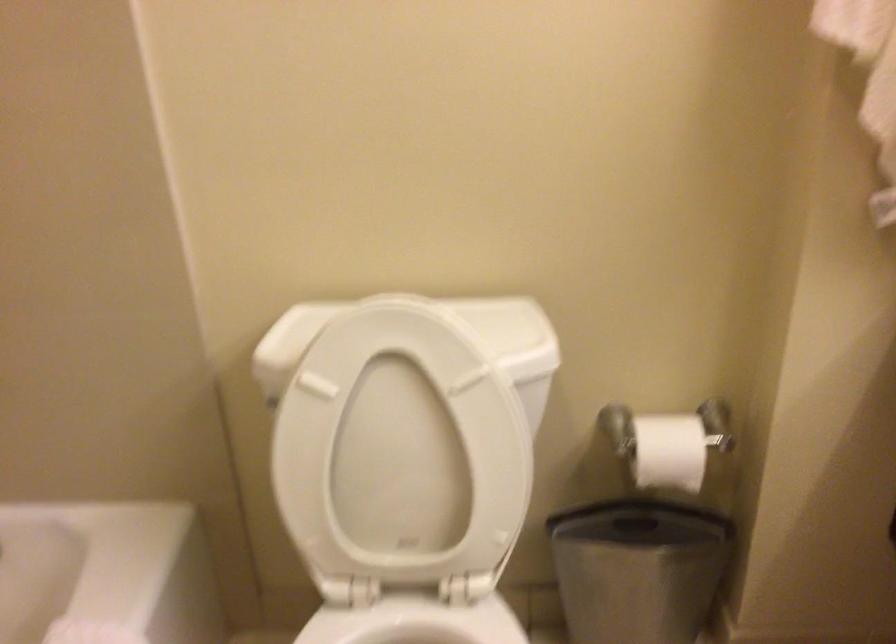
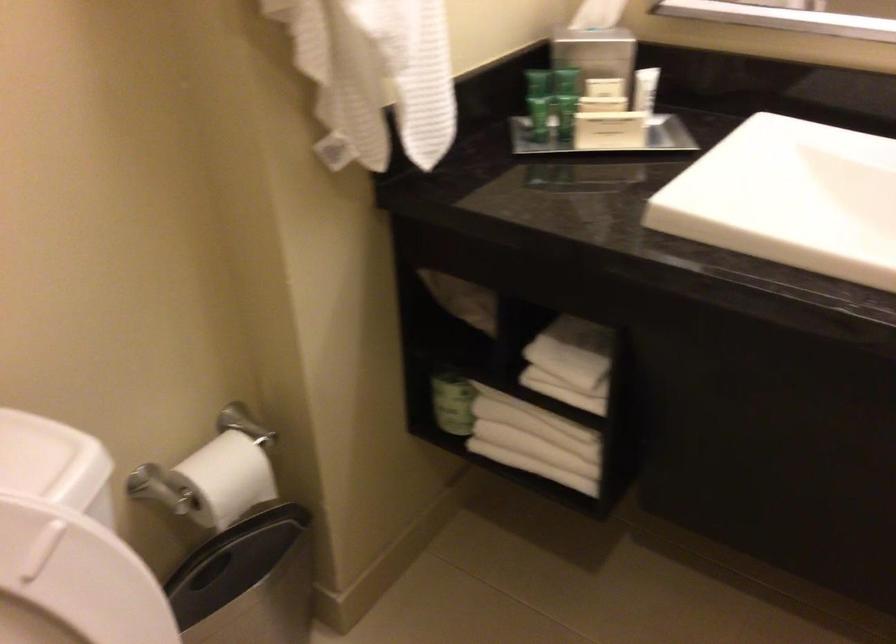
Question: The camera is either moving clockwise (left) or counter-clockwise (right) around the object. The first image is from the beginning of the video and the second image is from the end. Is the camera moving left or right when shooting the video?

Choices:
 (A) Left
 (B) Right

Answer: (A)